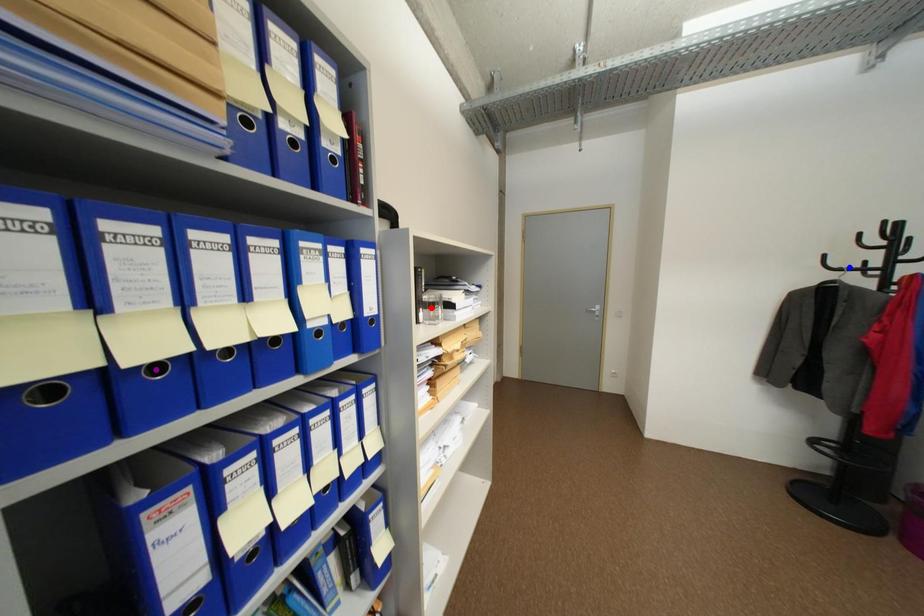
Order these from nearest to farthest:
- purple point
- blue point
- red point

blue point < red point < purple point